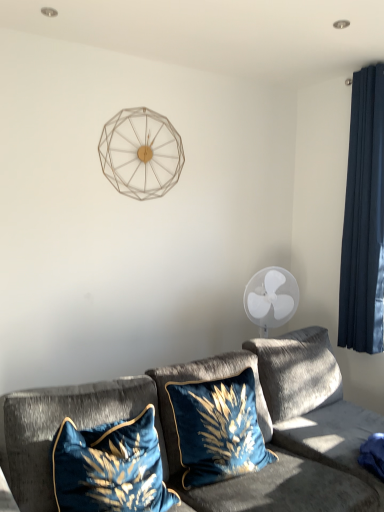
Find the location of a particular element. velvet blue pillow at lower left, positioned as the 1th pillow in left-to-right order is located at coordinates (110, 467).

Image resolution: width=384 pixels, height=512 pixels. What do you see at coordinates (364, 218) in the screenshot?
I see `dark blue velvet curtain at right` at bounding box center [364, 218].

Measure the distance between metallic wireframe clock at upper center and camera.

They are 2.72 meters apart.

Where is `velvet blue pillow at center, which ranks as the 2th pillow in left-to-right order`? The height and width of the screenshot is (512, 384). velvet blue pillow at center, which ranks as the 2th pillow in left-to-right order is located at coordinates (218, 429).

Is velvet gray couch at lower center looking in the opposite direction of metallic wireframe clock at upper center?

velvet gray couch at lower center is not turned away from metallic wireframe clock at upper center.

How different are the orientations of velvet gray couch at lower center and metallic wireframe clock at upper center in degrees?

There is a 9.56-degree angle between the facing directions of velvet gray couch at lower center and metallic wireframe clock at upper center.

Is velvet gray couch at lower center taller or shorter than metallic wireframe clock at upper center?

In the image, velvet gray couch at lower center appears to be taller than metallic wireframe clock at upper center.

Looking at the image, does velvet gray couch at lower center seem bigger or smaller compared to metallic wireframe clock at upper center?

Clearly, velvet gray couch at lower center is larger in size than metallic wireframe clock at upper center.

Is metallic wireframe clock at upper center positioned far away from velvet blue pillow at lower left, acting as the 2th pillow starting from the right?

That's right, there is a large distance between metallic wireframe clock at upper center and velvet blue pillow at lower left, acting as the 2th pillow starting from the right.

Which is more to the right, metallic wireframe clock at upper center or velvet blue pillow at lower left, positioned as the 1th pillow in left-to-right order?

velvet blue pillow at lower left, positioned as the 1th pillow in left-to-right order, is more to the right.

Does metallic wireframe clock at upper center have a greater width compared to velvet blue pillow at lower left, acting as the 2th pillow starting from the right?

No.

Is point (93, 498) closer or farther from the camera than point (244, 456)?

Clearly, point (93, 498) is closer to the camera than point (244, 456).

Between velvet blue pillow at lower left, positioned as the 1th pillow in left-to-right order, and velvet blue pillow at center, which ranks as the 2th pillow in left-to-right order, which one appears on the right side from the viewer's perspective?

Positioned to the right is velvet blue pillow at center, which ranks as the 2th pillow in left-to-right order.

Which of these two, velvet blue pillow at lower left, positioned as the 1th pillow in left-to-right order, or velvet blue pillow at center, which ranks as the 2th pillow in left-to-right order, is thinner?

velvet blue pillow at center, which ranks as the 2th pillow in left-to-right order.

Is velvet blue pillow at lower left, acting as the 2th pillow starting from the right, oriented away from velvet blue pillow at center, which is the 1th pillow from right to left?

velvet blue pillow at lower left, acting as the 2th pillow starting from the right, is not turned away from velvet blue pillow at center, which is the 1th pillow from right to left.

Is velvet blue pillow at lower left, acting as the 2th pillow starting from the right, wider or thinner than metallic wireframe clock at upper center?

velvet blue pillow at lower left, acting as the 2th pillow starting from the right, is wider than metallic wireframe clock at upper center.

Between velvet blue pillow at lower left, positioned as the 1th pillow in left-to-right order, and metallic wireframe clock at upper center, which one has less height?

velvet blue pillow at lower left, positioned as the 1th pillow in left-to-right order.

Does point (110, 509) come behind point (121, 119)?

No, it is not.

From the image's perspective, is velvet blue pillow at lower left, acting as the 2th pillow starting from the right, above or below dark blue velvet curtain at right?

From the image's perspective, velvet blue pillow at lower left, acting as the 2th pillow starting from the right, appears below dark blue velvet curtain at right.

Based on their positions, is velvet blue pillow at lower left, acting as the 2th pillow starting from the right, located to the left or right of dark blue velvet curtain at right?

Based on their positions, velvet blue pillow at lower left, acting as the 2th pillow starting from the right, is located to the left of dark blue velvet curtain at right.

In terms of height, does velvet blue pillow at lower left, acting as the 2th pillow starting from the right, look taller or shorter compared to dark blue velvet curtain at right?

velvet blue pillow at lower left, acting as the 2th pillow starting from the right, is shorter than dark blue velvet curtain at right.

Does velvet blue pillow at center, which ranks as the 2th pillow in left-to-right order, have a larger size compared to velvet gray couch at lower center?

No, velvet blue pillow at center, which ranks as the 2th pillow in left-to-right order, is not bigger than velvet gray couch at lower center.

Which of these two, velvet blue pillow at center, which is the 1th pillow from right to left, or velvet gray couch at lower center, is wider?

velvet gray couch at lower center is wider.

Is velvet gray couch at lower center at the back of velvet blue pillow at center, which ranks as the 2th pillow in left-to-right order?

Absolutely, velvet blue pillow at center, which ranks as the 2th pillow in left-to-right order, is directed away from velvet gray couch at lower center.

Does point (187, 407) appear closer or farther from the camera than point (7, 462)?

Clearly, point (187, 407) is more distant from the camera than point (7, 462).

Can you confirm if velvet gray couch at lower center is positioned to the right of dark blue velvet curtain at right?

In fact, velvet gray couch at lower center is to the left of dark blue velvet curtain at right.

Does point (181, 490) appear closer or farther from the camera than point (345, 219)?

Point (181, 490) appears to be closer to the viewer than point (345, 219).

The height and width of the screenshot is (512, 384). In the image, there is a velvet gray couch at lower center. Find the location of `lamp above it (from the image's perspective)`. lamp above it (from the image's perspective) is located at coordinates (141, 153).

From the image's perspective, count 2nd pillows downward from the metallic wireframe clock at upper center and point to it. Please provide its 2D coordinates.

[(110, 467)]

From the picture: Considering their positions, is dark blue velvet curtain at right positioned closer to velvet gray couch at lower center than velvet blue pillow at lower left, positioned as the 1th pillow in left-to-right order?

Based on the image, velvet blue pillow at lower left, positioned as the 1th pillow in left-to-right order, appears to be nearer to velvet gray couch at lower center.

From the image, which object appears to be farther from velvet gray couch at lower center, dark blue velvet curtain at right or velvet blue pillow at center, which ranks as the 2th pillow in left-to-right order?

dark blue velvet curtain at right is further to velvet gray couch at lower center.

From the image, which object appears to be nearer to dark blue velvet curtain at right, velvet blue pillow at lower left, positioned as the 1th pillow in left-to-right order, or velvet blue pillow at center, which ranks as the 2th pillow in left-to-right order?

Based on the image, velvet blue pillow at center, which ranks as the 2th pillow in left-to-right order, appears to be nearer to dark blue velvet curtain at right.

Based on their spatial positions, is velvet blue pillow at center, which ranks as the 2th pillow in left-to-right order, or velvet gray couch at lower center further from metallic wireframe clock at upper center?

The object further to metallic wireframe clock at upper center is velvet blue pillow at center, which ranks as the 2th pillow in left-to-right order.

Looking at the image, which one is located further to velvet blue pillow at lower left, acting as the 2th pillow starting from the right, velvet blue pillow at center, which ranks as the 2th pillow in left-to-right order, or dark blue velvet curtain at right?

dark blue velvet curtain at right.

Looking at the image, which one is located further to velvet blue pillow at center, which ranks as the 2th pillow in left-to-right order, velvet blue pillow at lower left, acting as the 2th pillow starting from the right, or metallic wireframe clock at upper center?

Among the two, metallic wireframe clock at upper center is located further to velvet blue pillow at center, which ranks as the 2th pillow in left-to-right order.

Based on their spatial positions, is velvet blue pillow at center, which ranks as the 2th pillow in left-to-right order, or velvet gray couch at lower center further from dark blue velvet curtain at right?

The object further to dark blue velvet curtain at right is velvet blue pillow at center, which ranks as the 2th pillow in left-to-right order.

When comparing their distances from velvet blue pillow at lower left, acting as the 2th pillow starting from the right, does velvet blue pillow at center, which is the 1th pillow from right to left, or velvet gray couch at lower center seem further?

Based on the image, velvet blue pillow at center, which is the 1th pillow from right to left, appears to be further to velvet blue pillow at lower left, acting as the 2th pillow starting from the right.

Locate an element on the screen. The width and height of the screenshot is (384, 512). curtain between velvet gray couch at lower center and metallic wireframe clock at upper center in the front-back direction is located at coordinates (364, 218).

Locate an element on the screen. The width and height of the screenshot is (384, 512). pillow between velvet blue pillow at lower left, acting as the 2th pillow starting from the right, and dark blue velvet curtain at right is located at coordinates 218,429.

You are a GUI agent. You are given a task and a screenshot of the screen. Output one action in this format:
    pyautogui.click(x=<x>, y=<y>)
    Task: Click on the pillow between metallic wireframe clock at upper center and velvet blue pillow at lower left, acting as the 2th pillow starting from the right, in the up-down direction
    
    Given the screenshot: What is the action you would take?
    pyautogui.click(x=218, y=429)

Locate an element on the screen. Image resolution: width=384 pixels, height=512 pixels. pillow positioned between velvet gray couch at lower center and velvet blue pillow at center, which ranks as the 2th pillow in left-to-right order, from near to far is located at coordinates click(110, 467).